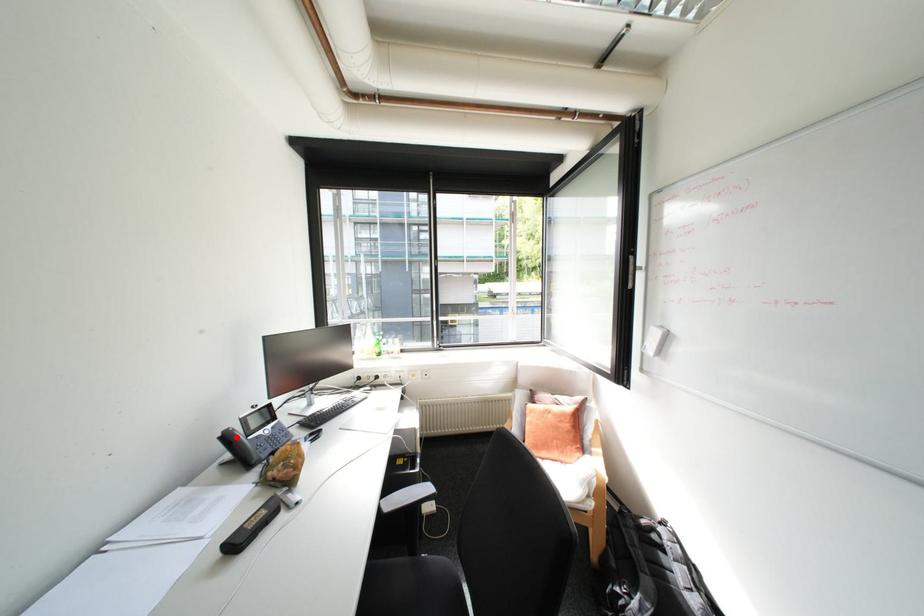
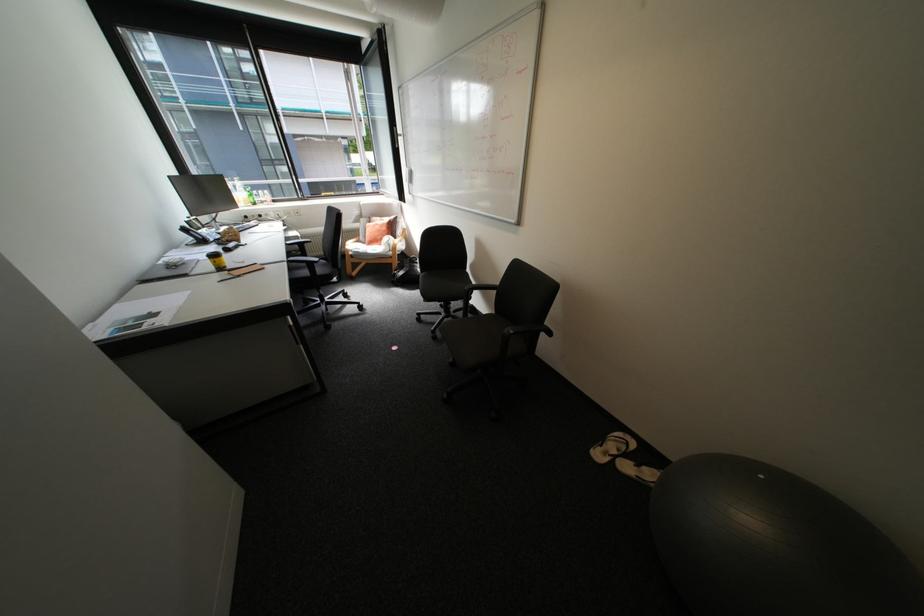
The point at the highlighted location is marked in the first image. Where is the corresponding point in the second image?

(195, 230)